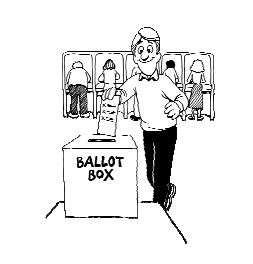
This screenshot has height=264, width=253. Identify the location of black outlined table. pyautogui.click(x=171, y=220), pyautogui.click(x=142, y=201), pyautogui.click(x=50, y=210).